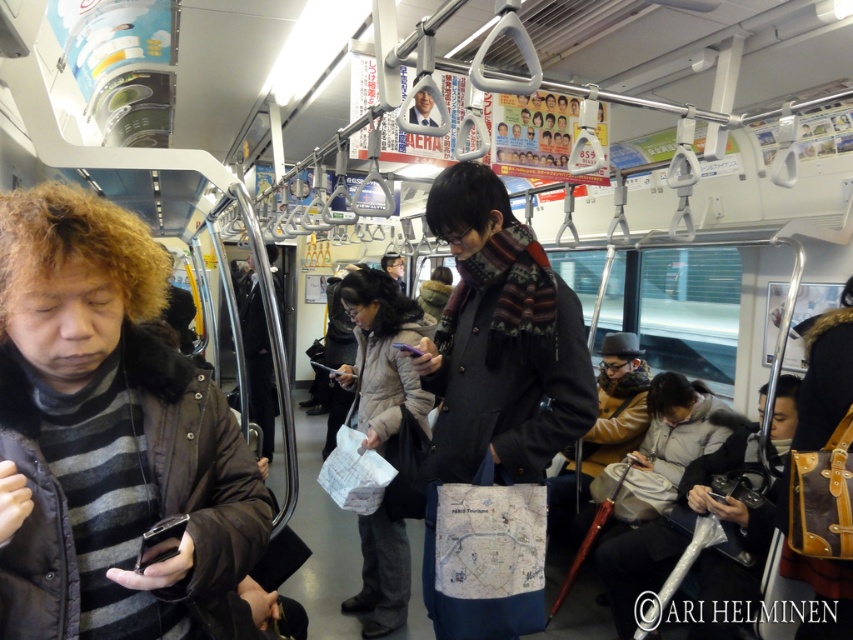
Between point (457, 333) and point (547, 481), which one is positioned in front?

Point (457, 333) is more forward.

Who is more forward, (492, 330) or (625, 436)?

Point (492, 330) is more forward.

Find the location of a particular element. dark gray fabric bag at center is located at coordinates (500, 340).

Between striped wool sweater at left and dark gray wool scarf at center, which one appears on the right side from the viewer's perspective?

From the viewer's perspective, striped wool sweater at left appears more on the right side.

This screenshot has width=853, height=640. What are the coordinates of `striped wool sweater at left` in the screenshot? It's located at (109, 436).

This screenshot has height=640, width=853. I want to click on striped wool sweater at left, so click(109, 436).

Is point (250, 608) behind point (483, 170)?

No, (250, 608) is closer to viewer.

Can you confirm if striped wool sweater at left is positioned to the left of dark gray fabric bag at center?

Correct, you'll find striped wool sweater at left to the left of dark gray fabric bag at center.

Is point (204, 396) farther from viewer compared to point (544, 355)?

No, it is not.

At what (x,y) coordinates should I click in order to perform the action: click on striped wool sweater at left. Please return your answer as a coordinate pair (x, y). The width and height of the screenshot is (853, 640). Looking at the image, I should click on (109, 436).